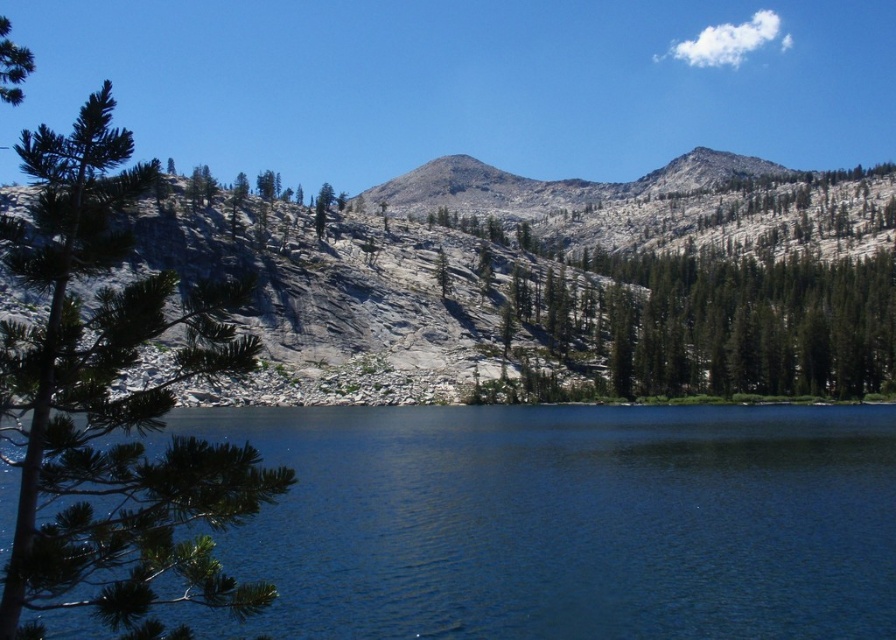
Question: Which object appears farthest from the camera in this image?

Choices:
 (A) gray rocky mountain at center
 (B) blue glassy water at center

Answer: (A)

Question: Which object appears farthest from the camera in this image?

Choices:
 (A) blue glassy water at center
 (B) gray rocky mountain at center
 (C) green matte tree at left

Answer: (B)

Question: Can you confirm if green matte tree at left is positioned above gray rocky mountain at center?

Choices:
 (A) no
 (B) yes

Answer: (A)

Question: Which point is closer to the camera?

Choices:
 (A) (737, 168)
 (B) (336, 426)

Answer: (B)

Question: Is blue glassy water at center smaller than green matte tree at left?

Choices:
 (A) no
 (B) yes

Answer: (B)

Question: Is the position of blue glassy water at center less distant than that of green matte tree at left?

Choices:
 (A) no
 (B) yes

Answer: (A)